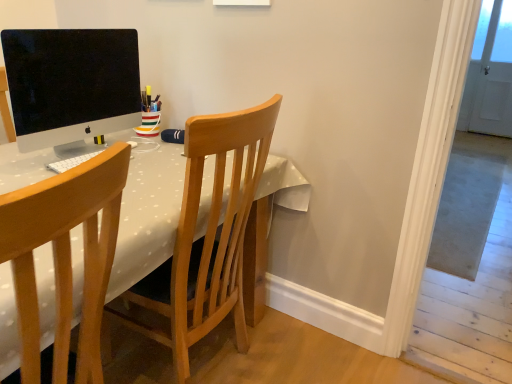
In order to face matte black monitor at upper left, should I rotate leftwards or rightwards?

To face it directly, rotate left by 23.173 degrees.

Measure the distance between white matte keyboard at center and camera.

white matte keyboard at center is 3.52 feet from camera.

In order to face white dotted fabric table at center, should I rotate leftwards or rightwards?

Turn left approximately 20.402 degrees to face it.

Describe the element at coordinates (148, 214) in the screenshot. The width and height of the screenshot is (512, 384). I see `white dotted fabric table at center` at that location.

At what (x,y) coordinates should I click in order to perform the action: click on wooden chair at left, placed as the 2th chair when sorted from back to front. Please return your answer as a coordinate pair (x, y). The height and width of the screenshot is (384, 512). Looking at the image, I should click on (65, 257).

Is white matte keyboard at center inside wooden chair at left, placed as the 2th chair when sorted from back to front?

Actually, white matte keyboard at center is outside wooden chair at left, placed as the 2th chair when sorted from back to front.

From the image's perspective, does wooden chair at left, placed as the 2th chair when sorted from back to front, appear higher than white matte keyboard at center?

No, from the image's perspective, wooden chair at left, placed as the 2th chair when sorted from back to front, is not over white matte keyboard at center.

Can you tell me how much wooden chair at left, the first chair viewed from the front, and white matte keyboard at center differ in facing direction?

The angle between the facing direction of wooden chair at left, the first chair viewed from the front, and the facing direction of white matte keyboard at center is 180 degrees.

Who is smaller, wooden chair at left, placed as the 2th chair when sorted from back to front, or white matte keyboard at center?

With smaller size is white matte keyboard at center.

Looking at their sizes, would you say wooden chair at center, which is the 1th chair in back-to-front order, is wider or thinner than wooden chair at left, placed as the 2th chair when sorted from back to front?

Clearly, wooden chair at center, which is the 1th chair in back-to-front order, has more width compared to wooden chair at left, placed as the 2th chair when sorted from back to front.

Would you consider wooden chair at center, marked as the 2th chair in a front-to-back arrangement, to be distant from wooden chair at left, the first chair viewed from the front?

wooden chair at center, marked as the 2th chair in a front-to-back arrangement, is near wooden chair at left, the first chair viewed from the front, not far away.

Looking at this image, from the image's perspective, would you say wooden chair at center, which is the 1th chair in back-to-front order, is shown under wooden chair at left, placed as the 2th chair when sorted from back to front?

No, from the image's perspective, wooden chair at center, which is the 1th chair in back-to-front order, is not below wooden chair at left, placed as the 2th chair when sorted from back to front.

Is wooden chair at center, which is the 1th chair in back-to-front order, bigger than wooden chair at left, the first chair viewed from the front?

Indeed, wooden chair at center, which is the 1th chair in back-to-front order, has a larger size compared to wooden chair at left, the first chair viewed from the front.

Which of these two, wooden chair at center, which is the 1th chair in back-to-front order, or white dotted fabric table at center, is bigger?

white dotted fabric table at center.

Identify the location of the 1st chair located above the white dotted fabric table at center (from a real-world perspective). (208, 235).

Is wooden chair at center, which is the 1th chair in back-to-front order, oriented away from white dotted fabric table at center?

Yes, wooden chair at center, which is the 1th chair in back-to-front order, is facing away from white dotted fabric table at center.

Is wooden chair at center, which is the 1th chair in back-to-front order, not inside white dotted fabric table at center?

No, wooden chair at center, which is the 1th chair in back-to-front order, is inside or overlapping with white dotted fabric table at center.

Which of these two, wooden chair at center, which is the 1th chair in back-to-front order, or white matte keyboard at center, stands shorter?

white matte keyboard at center is shorter.

Which object is thinner, wooden chair at center, which is the 1th chair in back-to-front order, or white matte keyboard at center?

Thinner between the two is white matte keyboard at center.

Considering the sizes of objects wooden chair at left, the first chair viewed from the front, and matte black monitor at upper left in the image provided, who is thinner, wooden chair at left, the first chair viewed from the front, or matte black monitor at upper left?

With smaller width is matte black monitor at upper left.

The height and width of the screenshot is (384, 512). I want to click on the 2nd chair in front of the matte black monitor at upper left, so click(x=65, y=257).

Considering the sizes of wooden chair at left, the first chair viewed from the front, and matte black monitor at upper left in the image, is wooden chair at left, the first chair viewed from the front, bigger or smaller than matte black monitor at upper left?

In the image, wooden chair at left, the first chair viewed from the front, appears to be larger than matte black monitor at upper left.

At what (x,y) coordinates should I click in order to perform the action: click on computer keyboard that is on the right side of matte black monitor at upper left. Please return your answer as a coordinate pair (x, y). Looking at the image, I should click on (71, 162).

From the image's perspective, is white matte keyboard at center located above or below matte black monitor at upper left?

white matte keyboard at center is below matte black monitor at upper left.

Can you confirm if white matte keyboard at center is taller than matte black monitor at upper left?

No.

From a real-world perspective, who is located higher, matte black monitor at upper left or wooden chair at left, the first chair viewed from the front?

matte black monitor at upper left, from a real-world perspective.

Which object is closer to the camera taking this photo, matte black monitor at upper left or wooden chair at left, the first chair viewed from the front?

wooden chair at left, the first chair viewed from the front, is more forward.

Is matte black monitor at upper left in contact with wooden chair at left, the first chair viewed from the front?

matte black monitor at upper left is not next to wooden chair at left, the first chair viewed from the front, and they're not touching.

From the white matte keyboard at center, count 2nd chairs forward and point to it. Please provide its 2D coordinates.

[(65, 257)]

Find the location of a particular element. The width and height of the screenshot is (512, 384). chair above the wooden chair at left, placed as the 2th chair when sorted from back to front (from the image's perspective) is located at coordinates (208, 235).

Looking at the image, which one is located further to matte black monitor at upper left, white matte keyboard at center or wooden chair at center, marked as the 2th chair in a front-to-back arrangement?

Based on the image, wooden chair at center, marked as the 2th chair in a front-to-back arrangement, appears to be further to matte black monitor at upper left.

When comparing their distances from wooden chair at left, the first chair viewed from the front, does matte black monitor at upper left or white matte keyboard at center seem closer?

white matte keyboard at center is positioned closer to the anchor wooden chair at left, the first chair viewed from the front.

Which object lies further to the anchor point wooden chair at center, marked as the 2th chair in a front-to-back arrangement, white matte keyboard at center or matte black monitor at upper left?

matte black monitor at upper left is positioned further to the anchor wooden chair at center, marked as the 2th chair in a front-to-back arrangement.

Based on their spatial positions, is wooden chair at left, placed as the 2th chair when sorted from back to front, or matte black monitor at upper left closer to white matte keyboard at center?

matte black monitor at upper left.

When comparing their distances from matte black monitor at upper left, does wooden chair at center, which is the 1th chair in back-to-front order, or white matte keyboard at center seem closer?

The object closer to matte black monitor at upper left is white matte keyboard at center.

Looking at the image, which one is located closer to wooden chair at center, marked as the 2th chair in a front-to-back arrangement, white dotted fabric table at center or wooden chair at left, the first chair viewed from the front?

Based on the image, white dotted fabric table at center appears to be nearer to wooden chair at center, marked as the 2th chair in a front-to-back arrangement.

Estimate the real-world distances between objects in this image. Which object is further from white dotted fabric table at center, wooden chair at center, which is the 1th chair in back-to-front order, or white matte keyboard at center?

wooden chair at center, which is the 1th chair in back-to-front order, is further to white dotted fabric table at center.

Which object lies further to the anchor point wooden chair at center, which is the 1th chair in back-to-front order, wooden chair at left, placed as the 2th chair when sorted from back to front, or white matte keyboard at center?

white matte keyboard at center lies further to wooden chair at center, which is the 1th chair in back-to-front order, than the other object.

At what (x,y) coordinates should I click in order to perform the action: click on computer monitor between wooden chair at left, the first chair viewed from the front, and white matte keyboard at center in the front-back direction. Please return your answer as a coordinate pair (x, y). Looking at the image, I should click on (71, 83).

The height and width of the screenshot is (384, 512). I want to click on table between matte black monitor at upper left and wooden chair at left, placed as the 2th chair when sorted from back to front, in the vertical direction, so click(148, 214).

Where is `chair between white dotted fabric table at center and white matte keyboard at center in the front-back direction`? chair between white dotted fabric table at center and white matte keyboard at center in the front-back direction is located at coordinates (208, 235).

Where is `computer monitor located between white dotted fabric table at center and white matte keyboard at center in the depth direction`? Image resolution: width=512 pixels, height=384 pixels. computer monitor located between white dotted fabric table at center and white matte keyboard at center in the depth direction is located at coordinates (71, 83).